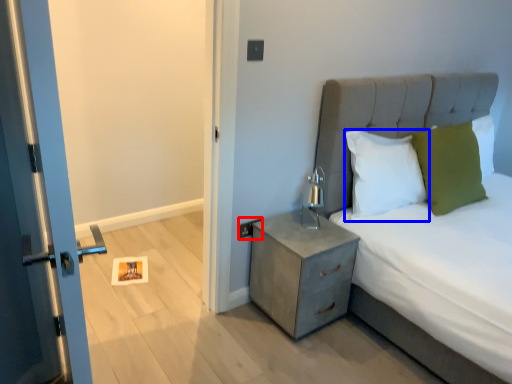
Question: Which object is further to the camera taking this photo, electric outlet (highlighted by a red box) or pillow (highlighted by a blue box)?

Choices:
 (A) electric outlet
 (B) pillow

Answer: (A)